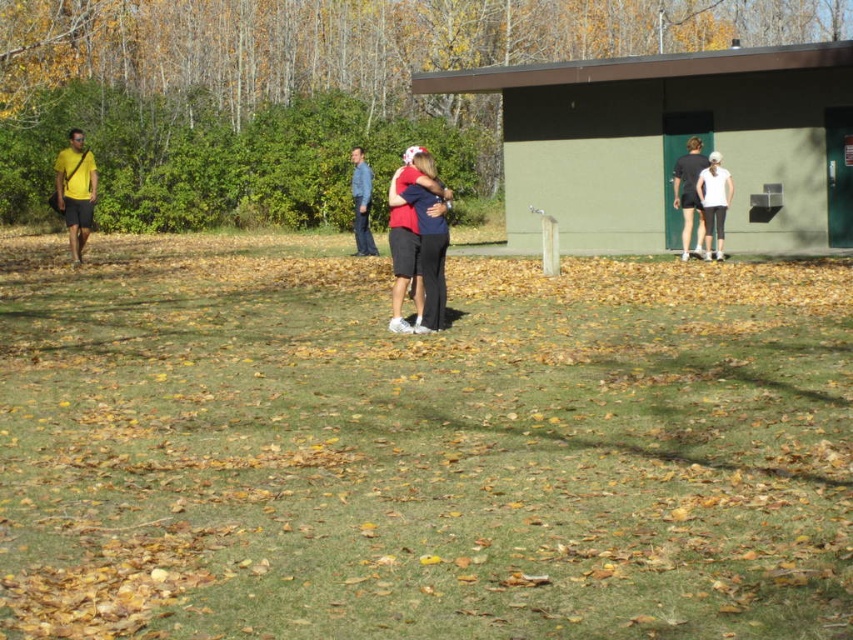
Is yellow matte shirt at left above blue denim jeans at center?

Indeed, yellow matte shirt at left is positioned over blue denim jeans at center.

Is point (73, 196) positioned in front of point (352, 195)?

Yes, it is.

Is point (73, 189) closer to camera compared to point (368, 211)?

Yes, point (73, 189) is in front of point (368, 211).

This screenshot has width=853, height=640. Find the location of `yellow matte shirt at left`. yellow matte shirt at left is located at coordinates (74, 189).

Does matte black shorts at center have a larger size compared to blue denim jeans at center?

No, matte black shorts at center is not bigger than blue denim jeans at center.

The height and width of the screenshot is (640, 853). I want to click on matte black shorts at center, so (410, 230).

Is yellow matte shirt at left above white matte leggings at right?

Yes, yellow matte shirt at left is above white matte leggings at right.

Can you confirm if yellow matte shirt at left is positioned to the right of white matte leggings at right?

Incorrect, yellow matte shirt at left is not on the right side of white matte leggings at right.

Is point (61, 211) farther from camera compared to point (715, 188)?

No, it is not.

Find the location of `yellow matte shirt at left`. yellow matte shirt at left is located at coordinates (74, 189).